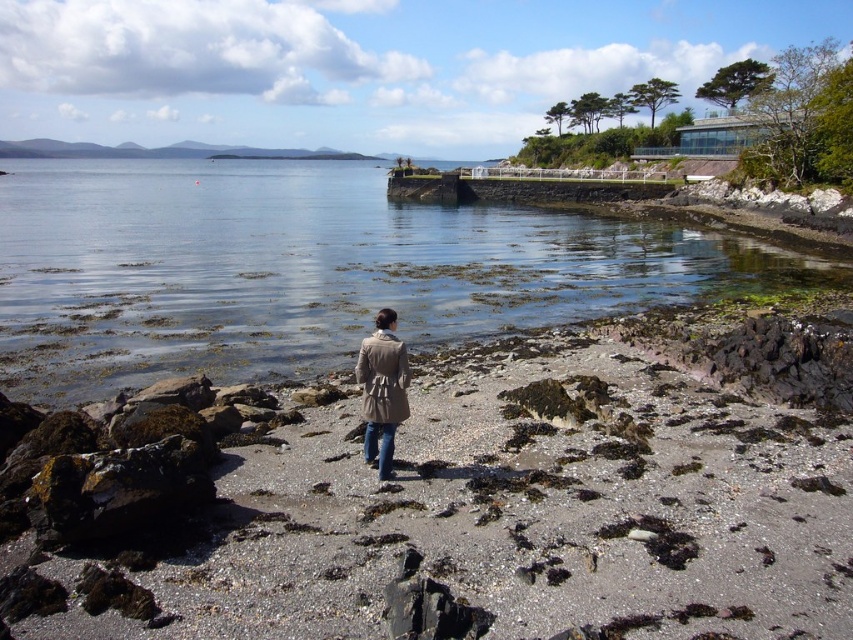
In the scene shown: You are standing on the rocky shoreline and want to place a 1.5 meter wide wooden board between the clear water at center and the tan textured trench coat at center. Can the board fit horizontally between them without overlapping either object?

The clear water at center is wider than the tan textured trench coat at center. Since the board is 1.5 meters wide, it might fit if the space between them is at least that wide. However, the description only states the width comparison between the two objects, not the distance between them. Without knowing the exact distance between the clear water at center and the tan textured trench coat at center, it is uncertain if the board can fit.

You are planning to build a small sandcastle on the smooth sand beach at center. Considering the width of the beach, will there be enough space to construct it without it being submerged by the clear water at center?

The smooth sand beach at center has a lesser width compared to clear water at center, so there might not be enough space to build a sandcastle without it being close to the water. Ensure to build it further inland on the beach to avoid submersion.